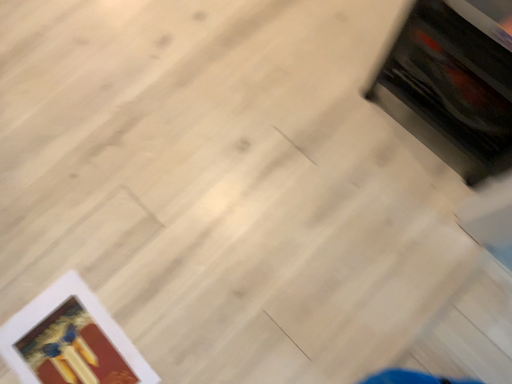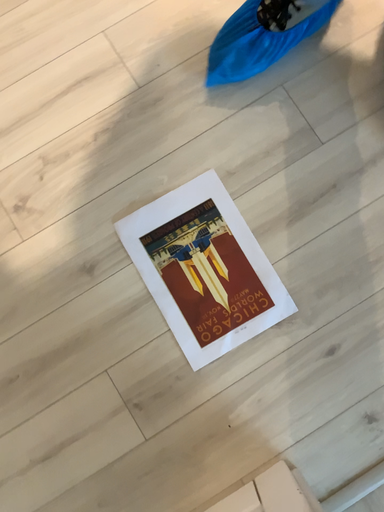
Question: Which way did the camera rotate in the video?

Choices:
 (A) rotated downward
 (B) rotated upward

Answer: (A)